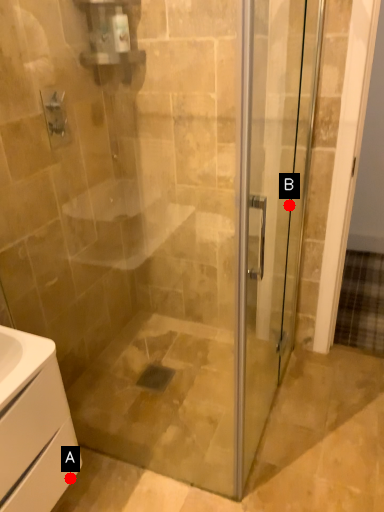
Question: Two points are circled on the image, labeled by A and B beside each circle. Which of the following is the closest to the observer?

Choices:
 (A) A is closer
 (B) B is closer

Answer: (A)